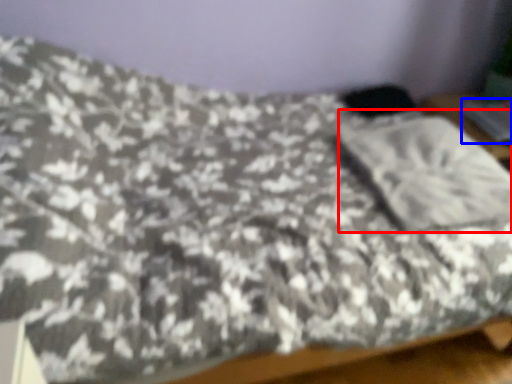
Question: Which object appears farthest to the camera in this image, pillow (highlighted by a red box) or silver (highlighted by a blue box)?

Choices:
 (A) pillow
 (B) silver

Answer: (B)